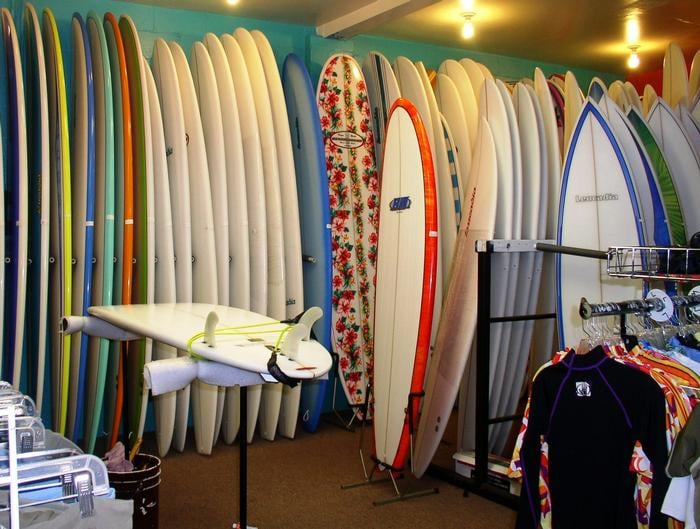
The height and width of the screenshot is (529, 700). Find the location of `foam top board`. foam top board is located at coordinates (108, 187), (82, 188), (105, 208), (57, 208), (24, 207), (15, 156), (41, 156), (315, 200).